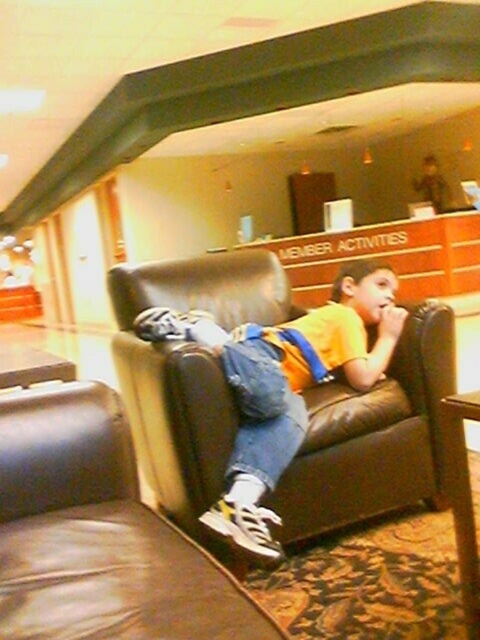
Which is more to the right, brown leather armchair at center or matte yellow shirt at center?

matte yellow shirt at center

The height and width of the screenshot is (640, 480). What do you see at coordinates (98, 532) in the screenshot? I see `brown leather armchair at center` at bounding box center [98, 532].

Which is in front, point (10, 532) or point (251, 497)?

Point (10, 532) is more forward.

Find the location of `brown leather armchair at center`. brown leather armchair at center is located at coordinates [x=98, y=532].